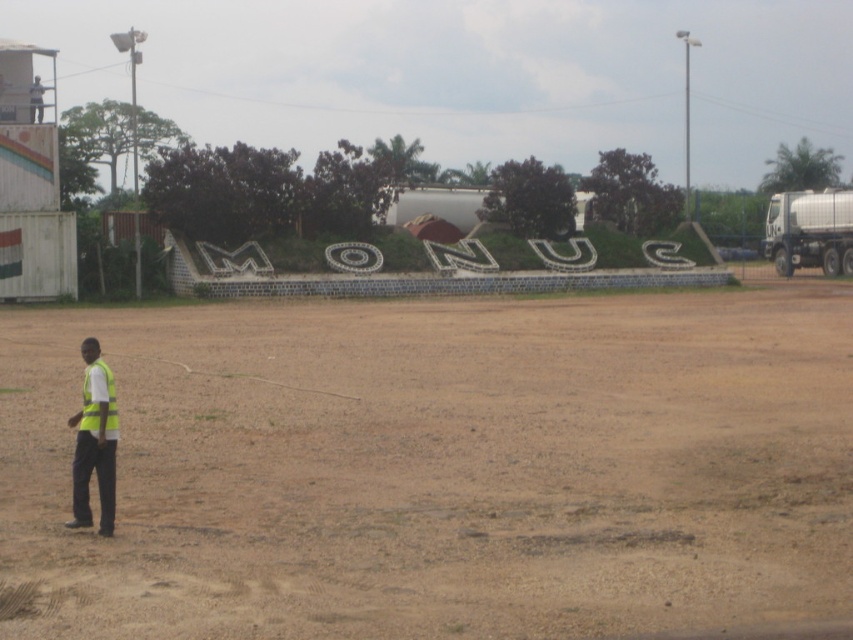
Between point (76, 524) and point (96, 396), which one is positioned behind?

The point (76, 524) is behind.

Can you confirm if yellow reflective vest at lower left is smaller than yellow reflective safety vest at lower left?

No.

Is point (91, 452) positioned behind point (85, 387)?

No, it is in front of (85, 387).

You are a GUI agent. You are given a task and a screenshot of the screen. Output one action in this format:
    pyautogui.click(x=<x>, y=<y>)
    Task: Click on the yellow reflective vest at lower left
    The height and width of the screenshot is (640, 853).
    Given the screenshot: What is the action you would take?
    pyautogui.click(x=94, y=442)

Find the location of `brown sandy dirt field at center`. brown sandy dirt field at center is located at coordinates (437, 467).

Can you confirm if brown sandy dirt field at center is positioned to the left of yellow reflective vest at lower left?

No, brown sandy dirt field at center is not to the left of yellow reflective vest at lower left.

The width and height of the screenshot is (853, 640). What do you see at coordinates (437, 467) in the screenshot? I see `brown sandy dirt field at center` at bounding box center [437, 467].

Locate an element on the screen. brown sandy dirt field at center is located at coordinates (437, 467).

Does point (840, 445) lie behind point (115, 400)?

Yes.

How much distance is there between brown sandy dirt field at center and yellow reflective safety vest at lower left?

The distance of brown sandy dirt field at center from yellow reflective safety vest at lower left is 14.78 meters.

Find the location of `brown sandy dirt field at center`. brown sandy dirt field at center is located at coordinates (437, 467).

In order to click on brown sandy dirt field at center in this screenshot , I will do click(437, 467).